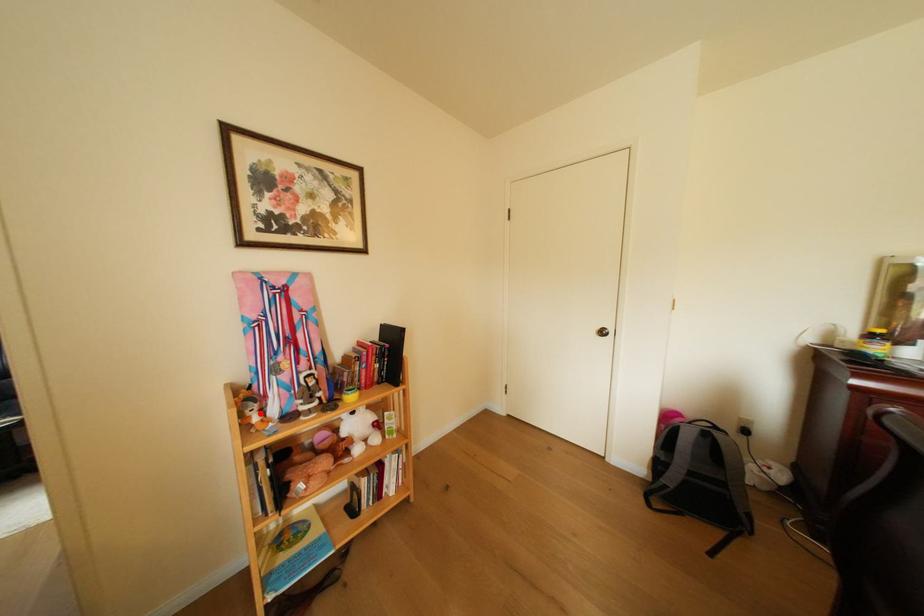
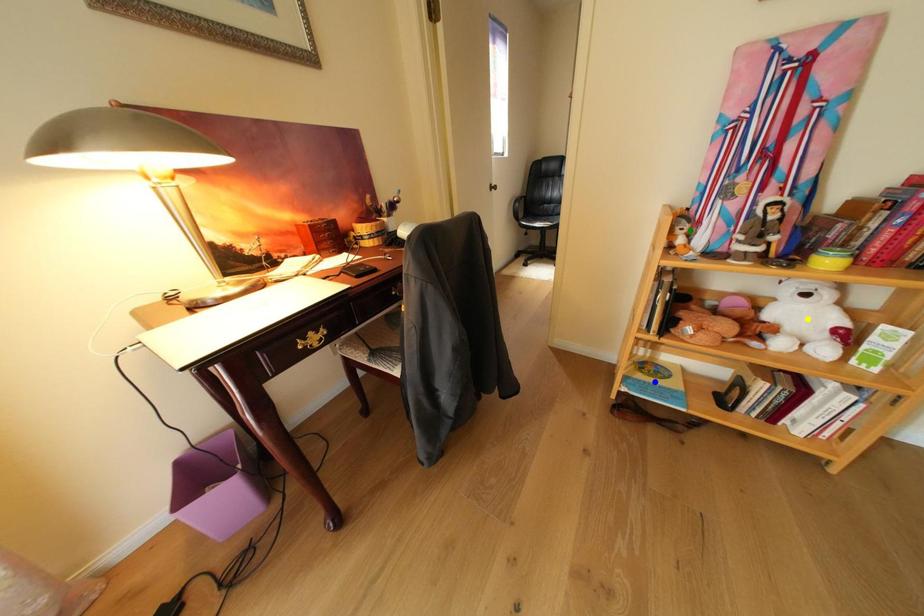
Question: I am providing you with two images of the same scene from different viewpoints. A red point is marked on the first image. You are given multiple points on the second image. Which point in image 2 represents the same 3d spot as the red point in image 1?

Choices:
 (A) yellow point
 (B) blue point
 (C) green point

Answer: (C)